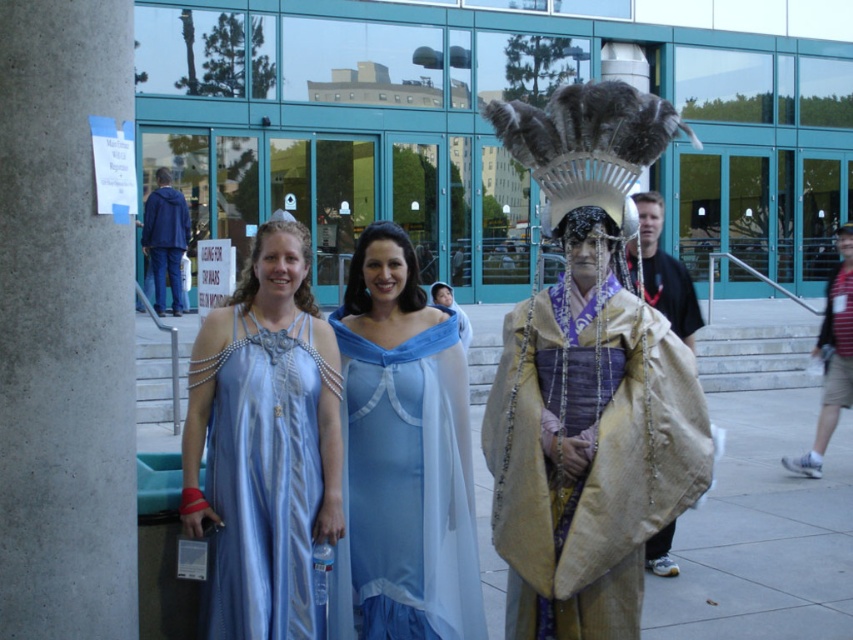
Consider the image. You are a photographer trying to capture the group of people in front of the modern building. You notice the gold textured cape at center and the satin blue dress at center. Which one is located to the right of the other?

The gold textured cape at center is positioned on the right side of the satin blue dress at center.